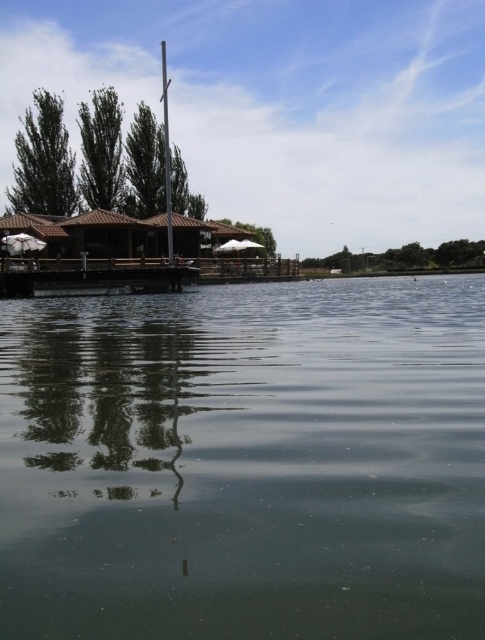
Question: Is clear water at center wider than smooth gray pole at center?

Choices:
 (A) no
 (B) yes

Answer: (B)

Question: Can you confirm if clear water at center is positioned below smooth gray pole at center?

Choices:
 (A) yes
 (B) no

Answer: (A)

Question: Which point is closer to the camera?

Choices:
 (A) clear water at center
 (B) smooth gray pole at center

Answer: (A)

Question: Which of the following is the closest to the observer?

Choices:
 (A) clear water at center
 (B) smooth gray pole at center

Answer: (A)

Question: Can you confirm if clear water at center is smaller than smooth gray pole at center?

Choices:
 (A) no
 (B) yes

Answer: (B)